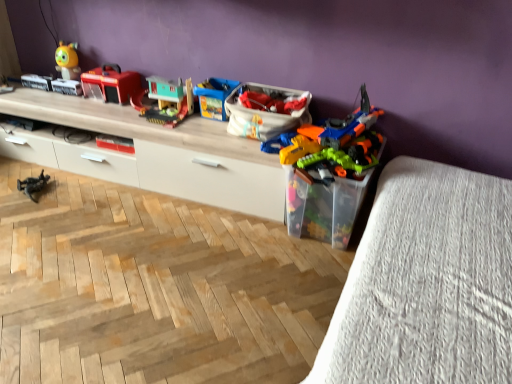
Locate an element on the screen. This screenshot has height=384, width=512. free space in front of translucent plastic storage box at center-right, acting as the 1th storage box starting from the bottom is located at coordinates (305, 267).